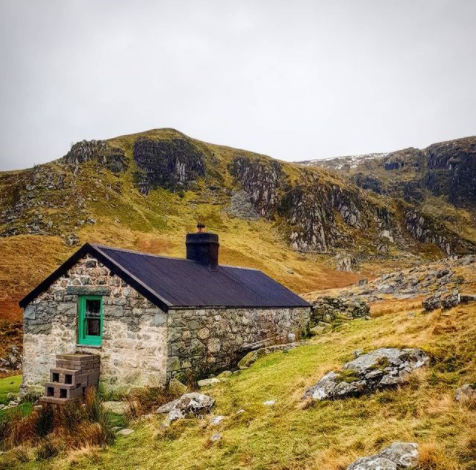
Image resolution: width=476 pixels, height=470 pixels. I want to click on stairs, so click(x=68, y=380).